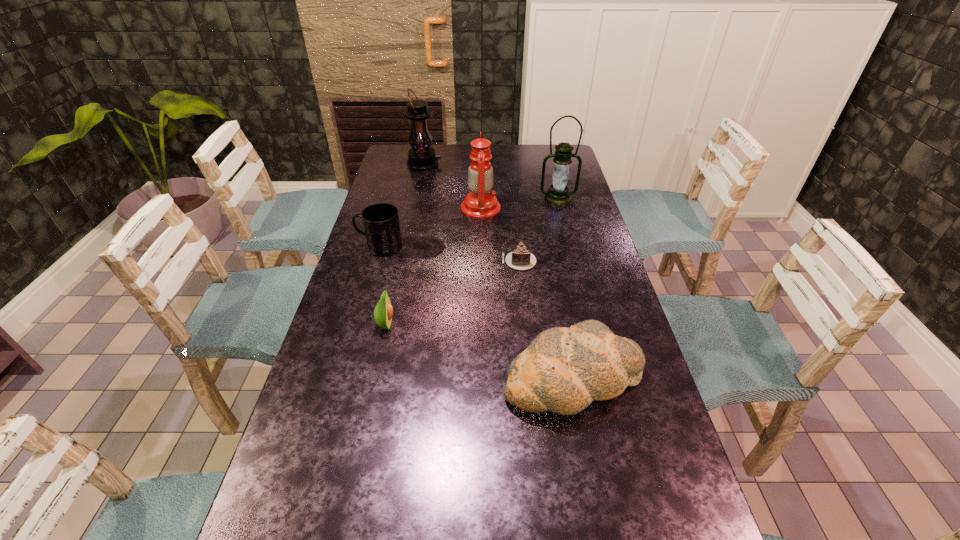
Where is `vacant area located on the back of the oil lamp`? The image size is (960, 540). vacant area located on the back of the oil lamp is located at coordinates (481, 152).

Find the location of a particular element. The width and height of the screenshot is (960, 540). vacant space located 0.110m on the front of the nearest object is located at coordinates (591, 472).

Identify the location of vacant space located 0.160m on the cut side of the sixth farthest object. The height and width of the screenshot is (540, 960). (453, 325).

Find the location of `vacant space located on the back of the chocolate cake`. vacant space located on the back of the chocolate cake is located at coordinates (516, 230).

Where is `object positioned at the far edge`? object positioned at the far edge is located at coordinates (421, 157).

You are a GUI agent. You are given a task and a screenshot of the screen. Output one action in this format:
    pyautogui.click(x=<x>, y=<y>)
    Task: Click on the lantern that is at the left edge
    The height and width of the screenshot is (540, 960).
    Given the screenshot: What is the action you would take?
    pyautogui.click(x=421, y=157)

Identify the location of mug at the left edge. click(381, 224).

You are a GUI agent. You are given a task and a screenshot of the screen. Output one action in this format:
    pyautogui.click(x=<x>, y=<y>)
    Task: Click on the avocado positioned at the left edge
    
    Given the screenshot: What is the action you would take?
    pyautogui.click(x=383, y=312)

Where is `lantern at the right edge`? This screenshot has height=540, width=960. lantern at the right edge is located at coordinates (558, 194).

I want to click on bread that is positioned at the right edge, so click(563, 370).